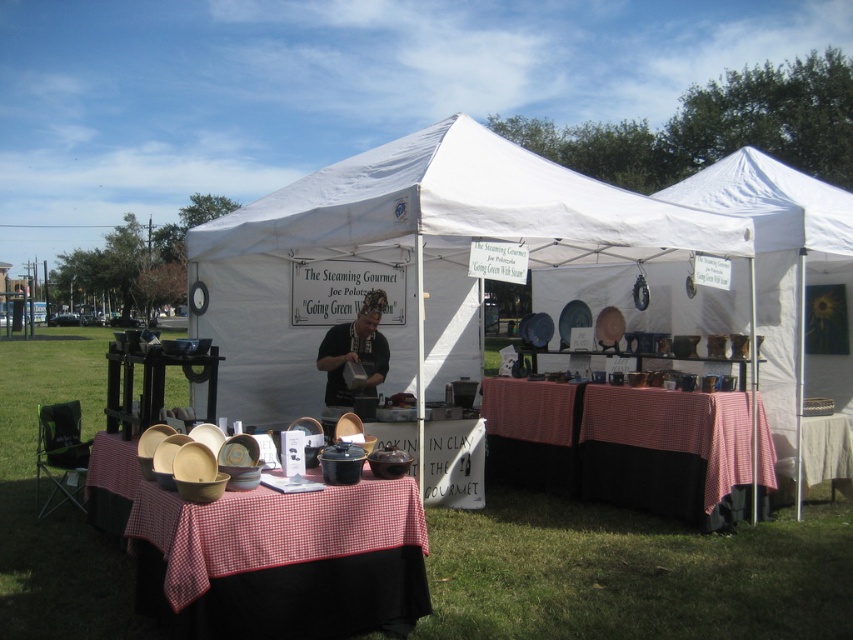
Question: Is white fabric tent at center further to the viewer compared to matte clay bowls at center?

Choices:
 (A) yes
 (B) no

Answer: (A)

Question: Which point appears closest to the camera in this image?

Choices:
 (A) (347, 403)
 (B) (392, 554)
 (C) (554, 227)
 (D) (601, 474)

Answer: (B)

Question: Is matte clay bowls at center closer to the viewer compared to checkered fabric picnic table at center?

Choices:
 (A) no
 (B) yes

Answer: (B)

Question: Which of the following is the closest to the observer?

Choices:
 (A) matte clay bowls at center
 (B) white fabric tent at center

Answer: (A)

Question: Which point is closer to the camera?

Choices:
 (A) (648, 477)
 (B) (96, 506)
 (C) (434, 209)
 (D) (355, 330)

Answer: (C)

Question: Considering the relative positions of matte clay bowls at center and matte black shirt at center in the image provided, where is matte clay bowls at center located with respect to matte black shirt at center?

Choices:
 (A) left
 (B) right

Answer: (A)